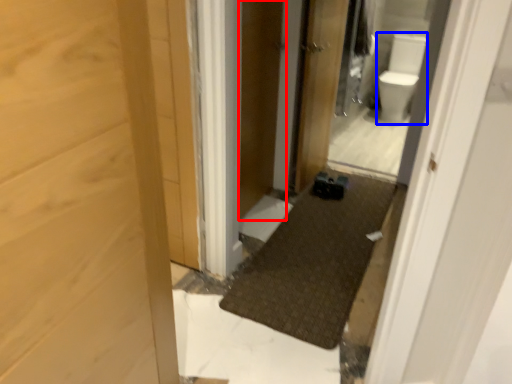
Question: Which of the following is the closest to the observer, screen door (highlighted by a red box) or toilet bowl (highlighted by a blue box)?

Choices:
 (A) screen door
 (B) toilet bowl

Answer: (A)